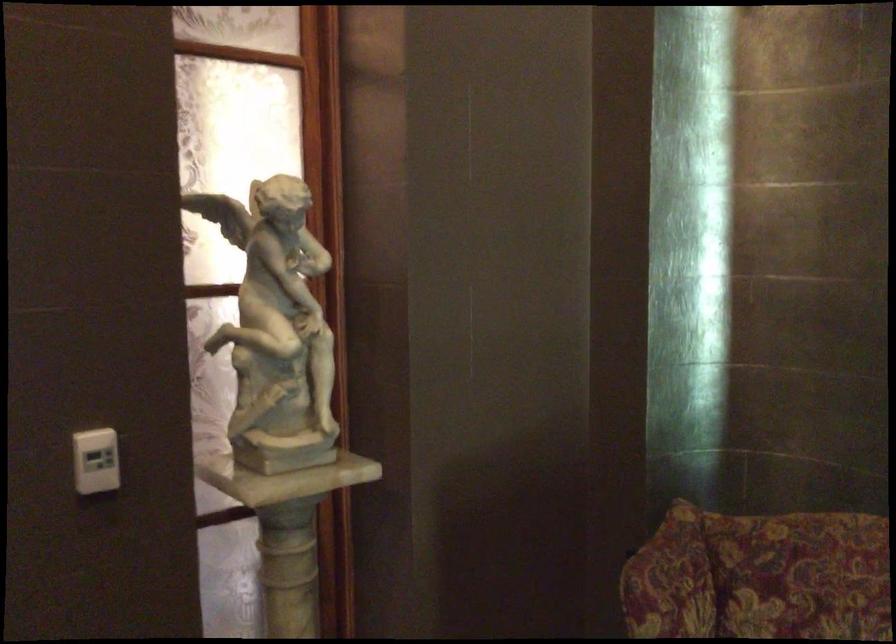
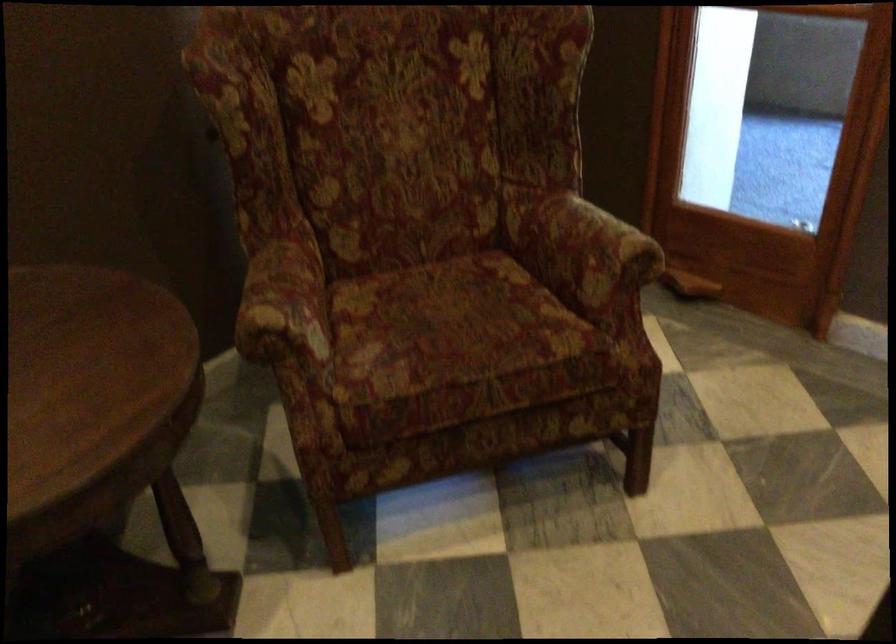
How did the camera likely rotate?

The rotation direction of the camera is right-down.